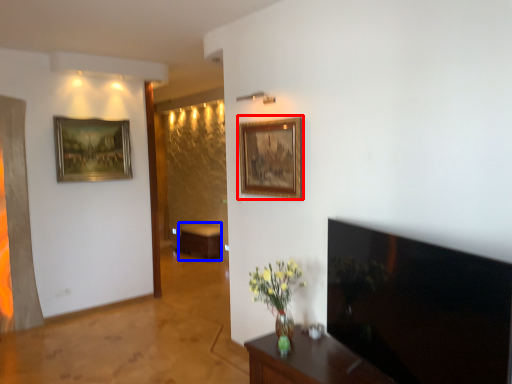
Question: Which point is closer to the camera, picture frame (highlighted by a red box) or table (highlighted by a blue box)?

Choices:
 (A) picture frame
 (B) table

Answer: (A)